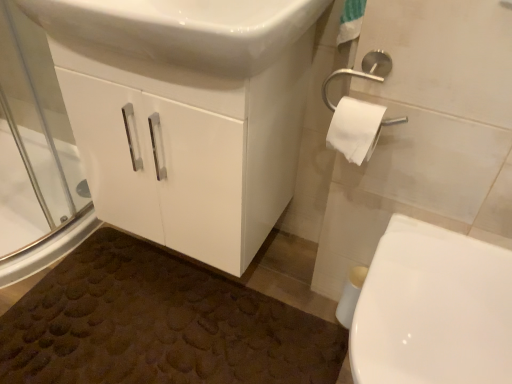
Question: Does white glossy cabinet at center have a greater width compared to white matte toilet paper at right?

Choices:
 (A) yes
 (B) no

Answer: (A)

Question: Is white glossy cabinet at center beside white matte toilet paper at right?

Choices:
 (A) no
 (B) yes

Answer: (A)

Question: From the image's perspective, is white glossy cabinet at center on white matte toilet paper at right?

Choices:
 (A) no
 (B) yes

Answer: (B)

Question: Is white glossy cabinet at center turned away from white matte toilet paper at right?

Choices:
 (A) yes
 (B) no

Answer: (B)

Question: Does white glossy cabinet at center have a greater height compared to white matte toilet paper at right?

Choices:
 (A) no
 (B) yes

Answer: (B)

Question: Is white glossy cabinet at center at the right side of white matte toilet paper at right?

Choices:
 (A) no
 (B) yes

Answer: (A)

Question: From the image's perspective, is transparent glass screen door at left below white glossy toilet at lower right?

Choices:
 (A) no
 (B) yes

Answer: (A)

Question: Is transparent glass screen door at left aimed at white glossy toilet at lower right?

Choices:
 (A) no
 (B) yes

Answer: (B)

Question: Is transparent glass screen door at left positioned before white glossy toilet at lower right?

Choices:
 (A) no
 (B) yes

Answer: (A)

Question: Is transparent glass screen door at left facing away from white glossy toilet at lower right?

Choices:
 (A) no
 (B) yes

Answer: (A)

Question: Can you confirm if transparent glass screen door at left is shorter than white glossy toilet at lower right?

Choices:
 (A) no
 (B) yes

Answer: (A)

Question: Is transparent glass screen door at left bigger than white glossy toilet at lower right?

Choices:
 (A) no
 (B) yes

Answer: (A)

Question: Is white glossy cabinet at center turned away from white glossy toilet at lower right?

Choices:
 (A) no
 (B) yes

Answer: (A)